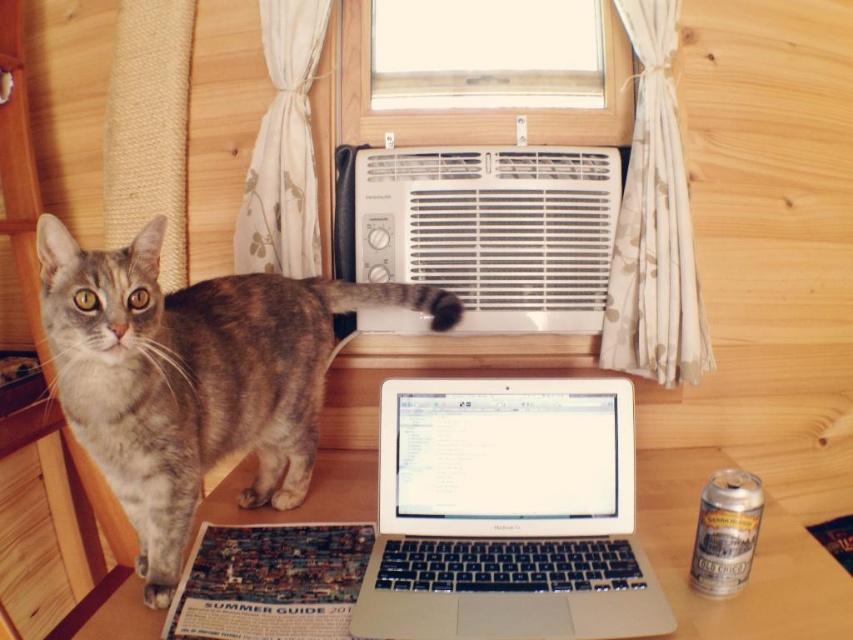
Question: Considering the relative positions of white plastic air conditioner at upper center and clear glass window at upper center in the image provided, where is white plastic air conditioner at upper center located with respect to clear glass window at upper center?

Choices:
 (A) below
 (B) above

Answer: (A)

Question: Estimate the real-world distances between objects in this image. Which object is closer to the wooden table at center?

Choices:
 (A) white plastic air conditioner at upper center
 (B) clear glass window at upper center
 (C) gray tabby cat at left

Answer: (A)

Question: Which object is closer to the camera taking this photo?

Choices:
 (A) wooden table at center
 (B) clear glass window at upper center
 (C) silver metallic laptop at center
 (D) gray tabby cat at left

Answer: (D)

Question: Is gray tabby cat at left wider than wooden table at center?

Choices:
 (A) yes
 (B) no

Answer: (A)

Question: Where is silver metallic laptop at center located in relation to clear glass window at upper center in the image?

Choices:
 (A) below
 (B) above

Answer: (A)

Question: Which point is farther from the camera taking this photo?

Choices:
 (A) (537, 596)
 (B) (479, 58)
 (C) (184, 513)
 (D) (299, 509)

Answer: (B)